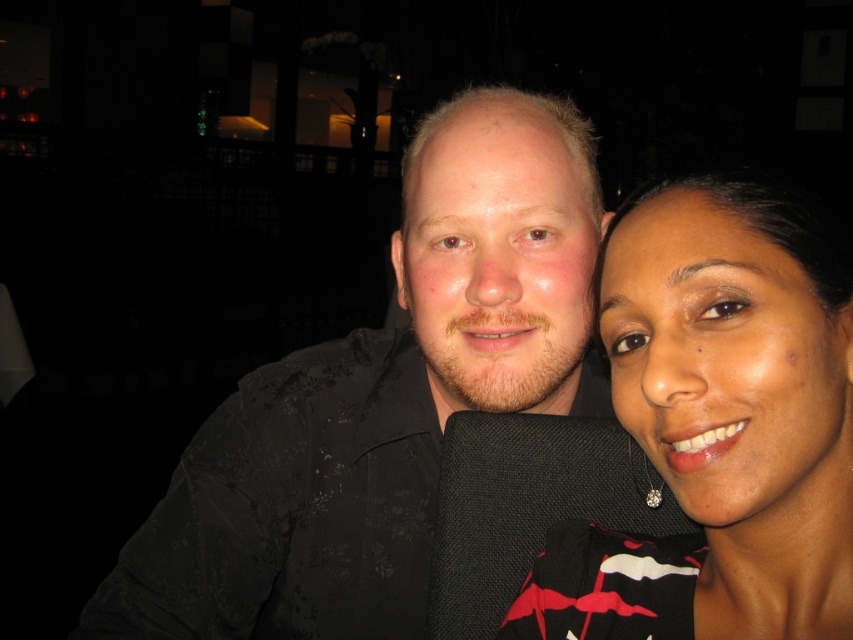
Measure the distance between point (352, 531) and camera.

A distance of 33.64 inches exists between point (352, 531) and camera.

Which is behind, point (410, 310) or point (627, 618)?

Point (410, 310)

Does point (287, 595) lie in front of point (712, 269)?

That is False.

You are a GUI agent. You are given a task and a screenshot of the screen. Output one action in this format:
    pyautogui.click(x=<x>, y=<y>)
    Task: Click on the black textured shirt at center
    
    Given the screenshot: What is the action you would take?
    pyautogui.click(x=381, y=400)